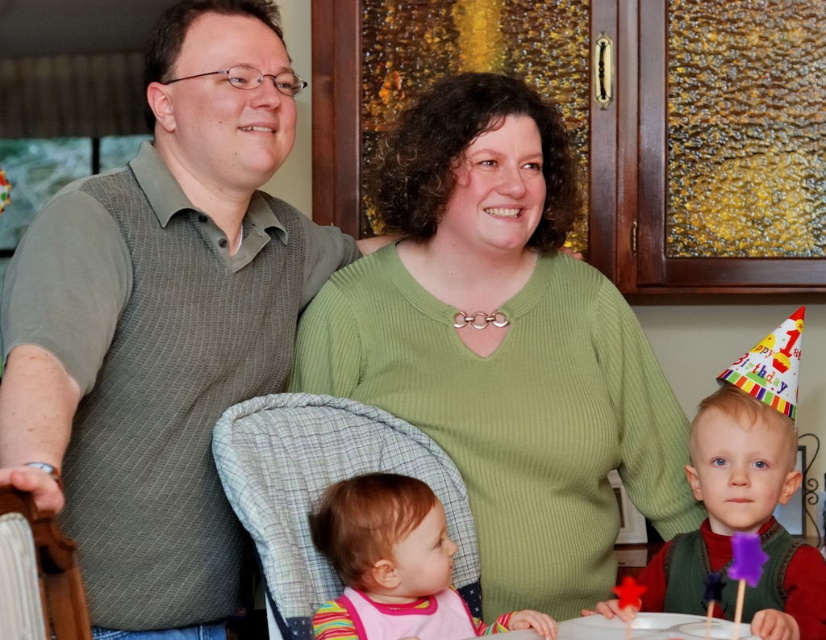
Question: Estimate the real-world distances between objects in this image. Which object is closer to the wooden chair at left?

Choices:
 (A) matte green vest at center
 (B) matte gray vest at center
 (C) plaid fabric baby carrier at center

Answer: (B)

Question: Which object is closer to the camera taking this photo?

Choices:
 (A) wooden chair at left
 (B) matte gray vest at center
 (C) plaid fabric baby carrier at center
 (D) green ribbed sweater at center

Answer: (A)

Question: Which of the following is the farthest from the observer?

Choices:
 (A) matte gray vest at center
 (B) plaid fabric baby carrier at center
 (C) wooden chair at left

Answer: (B)

Question: Is plaid fabric baby carrier at center to the left of pink fabric bib at center from the viewer's perspective?

Choices:
 (A) yes
 (B) no

Answer: (A)

Question: Is matte gray vest at center in front of green ribbed sweater at center?

Choices:
 (A) no
 (B) yes

Answer: (B)

Question: Does green ribbed sweater at center have a larger size compared to wooden chair at left?

Choices:
 (A) no
 (B) yes

Answer: (B)